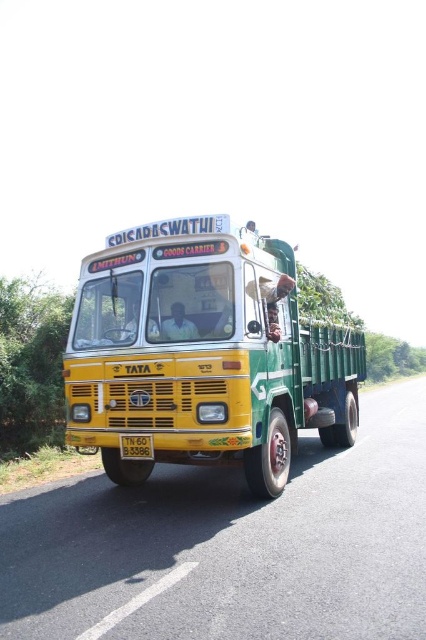
Question: Can you confirm if matte black shirt at center is positioned below smooth skin face at center?

Choices:
 (A) no
 (B) yes

Answer: (A)

Question: Which point is farther from the camera taking this photo?

Choices:
 (A) (146, 321)
 (B) (189, 326)
 (C) (146, 435)
 (D) (141, 307)

Answer: (D)

Question: Can you confirm if yellow matte bus at center is positioned above matte black shirt at center?

Choices:
 (A) no
 (B) yes

Answer: (B)

Question: Among these points, which one is nearest to the camera?

Choices:
 (A) (172, 330)
 (B) (124, 330)
 (C) (121, 436)
 (D) (399, 545)

Answer: (D)

Question: Is yellow matte bus at center wider than smooth skin face at center?

Choices:
 (A) yes
 (B) no

Answer: (B)

Question: Which point is closer to the camera?

Choices:
 (A) (160, 326)
 (B) (229, 308)

Answer: (B)